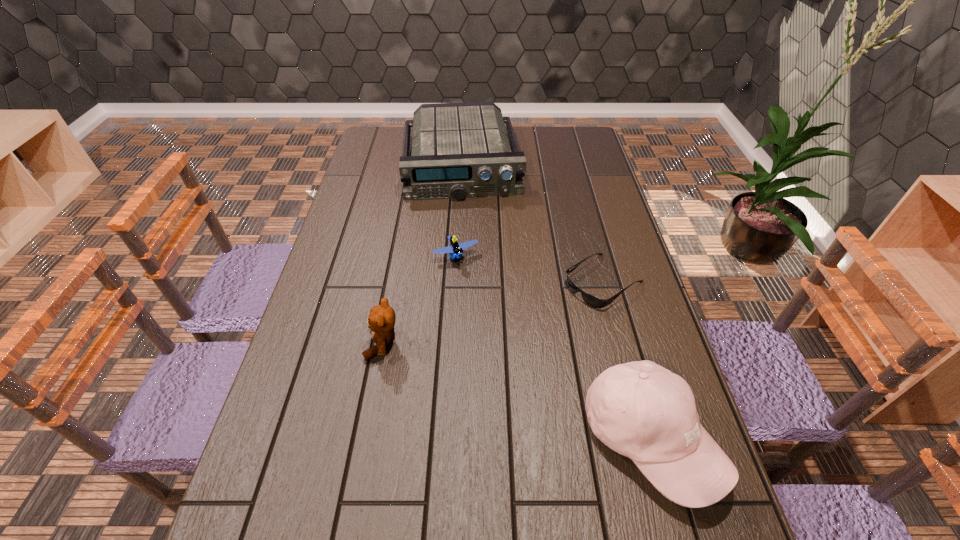
This screenshot has width=960, height=540. Identify the location of vacant space on the desktop that is between the second nearest object and the tallest object and is positioned on the front panel of the farthest object. (480, 378).

I want to click on vacant space on the desktop that is between the second nearest object and the nearest object and is positioned on the front-facing side of the shortest object, so click(471, 375).

This screenshot has height=540, width=960. What are the coordinates of `vacant space on the desktop that is between the teddy bear and the nearest object and is positioned on the front-facing side of the second shortest object` in the screenshot? It's located at (524, 394).